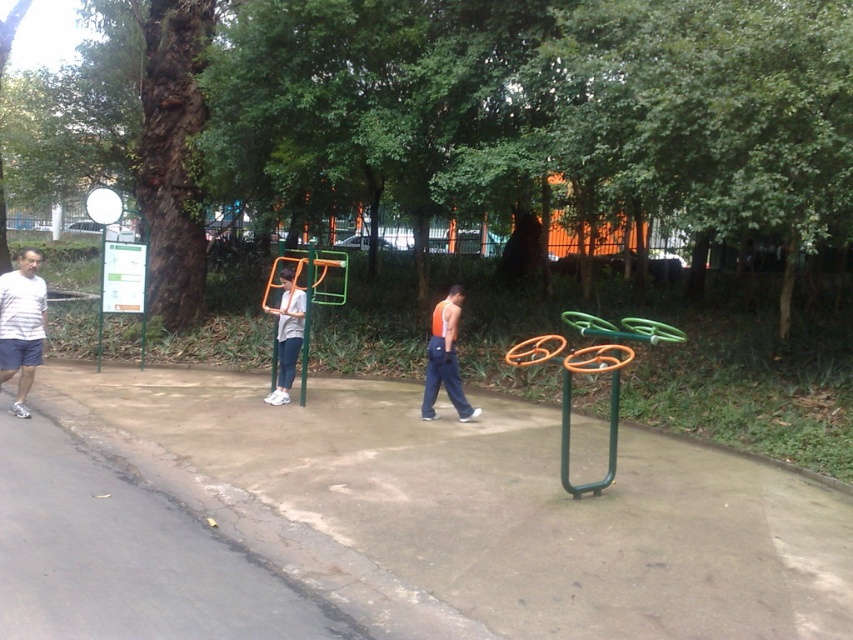
You are a delivery robot with a 3.5 feet wide package. You need to navigate through the paved pathway in the park scene. The pathway is 12 feet wide. Can you safely pass between the white striped shirt at left and the matte gray shirt at center without hitting either?

The distance between the white striped shirt at left and the matte gray shirt at center is 9.69 feet. Since the pathway is 12 feet wide and the robot with the package is 3.5 feet wide, there is enough space to navigate safely between them as long as the robot stays centered. However, the exact positioning of the individuals might affect clearance, but based on the given distance, it should be feasible.

You are a photographer positioned at the far end of the paved pathway. You want to capture a photo that includes both the concrete at center and the matte gray shirt at center. Which object will appear taller in the photograph?

The matte gray shirt at center will appear taller in the photograph because the concrete at center has a lesser height compared to it.